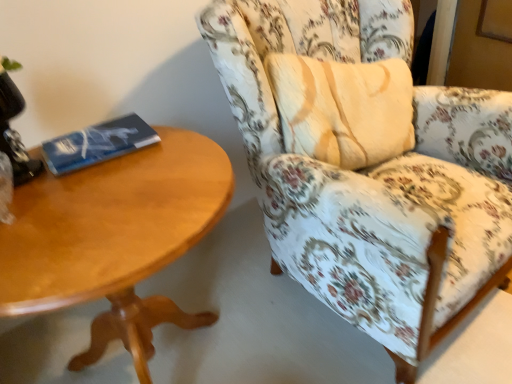
Question: Is light brown wood coffee table at left further to the viewer compared to black glass table lamp at upper left?

Choices:
 (A) yes
 (B) no

Answer: (B)

Question: Is light brown wood coffee table at left in contact with black glass table lamp at upper left?

Choices:
 (A) yes
 (B) no

Answer: (B)

Question: Considering the relative sizes of light brown wood coffee table at left and black glass table lamp at upper left in the image provided, is light brown wood coffee table at left bigger than black glass table lamp at upper left?

Choices:
 (A) yes
 (B) no

Answer: (A)

Question: Is there a large distance between light brown wood coffee table at left and black glass table lamp at upper left?

Choices:
 (A) yes
 (B) no

Answer: (B)

Question: Is black glass table lamp at upper left located within light brown wood coffee table at left?

Choices:
 (A) no
 (B) yes

Answer: (A)

Question: Does light brown wood coffee table at left lie in front of black glass table lamp at upper left?

Choices:
 (A) no
 (B) yes

Answer: (B)

Question: Is light brown wood coffee table at left next to blue matte paperback book at left?

Choices:
 (A) no
 (B) yes

Answer: (A)

Question: From a real-world perspective, is light brown wood coffee table at left physically above blue matte paperback book at left?

Choices:
 (A) yes
 (B) no

Answer: (B)

Question: From the image's perspective, does light brown wood coffee table at left appear lower than blue matte paperback book at left?

Choices:
 (A) yes
 (B) no

Answer: (A)

Question: Is light brown wood coffee table at left at the right side of blue matte paperback book at left?

Choices:
 (A) no
 (B) yes

Answer: (B)

Question: Can you confirm if light brown wood coffee table at left is wider than blue matte paperback book at left?

Choices:
 (A) no
 (B) yes

Answer: (B)

Question: Is the position of light brown wood coffee table at left more distant than that of blue matte paperback book at left?

Choices:
 (A) no
 (B) yes

Answer: (A)

Question: Is blue matte paperback book at left closer to the viewer compared to floral fabric chair at right?

Choices:
 (A) yes
 (B) no

Answer: (B)